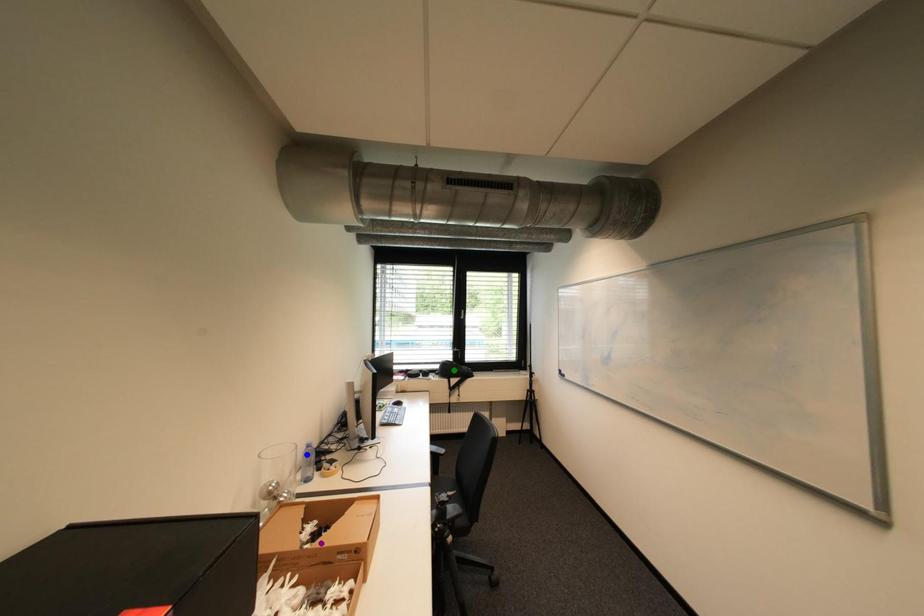
Order these from nearest to farthest:
purple point
green point
blue point

purple point < blue point < green point